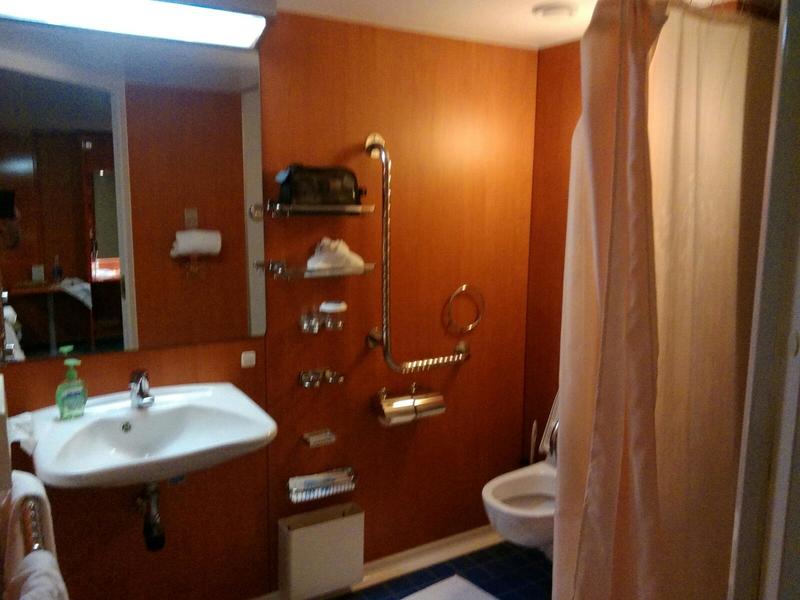
Identify the location of chrome cupholder. The image size is (800, 600). (314, 378).